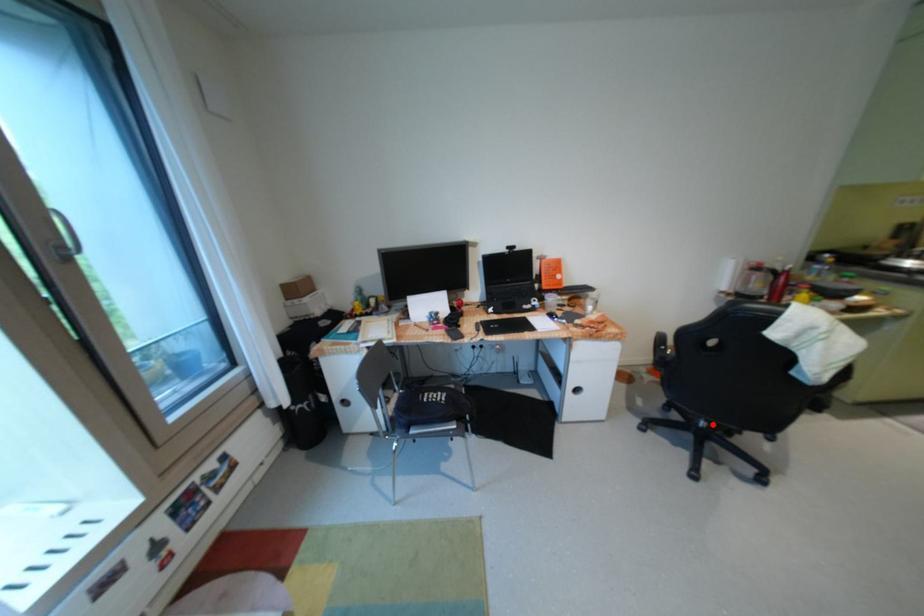
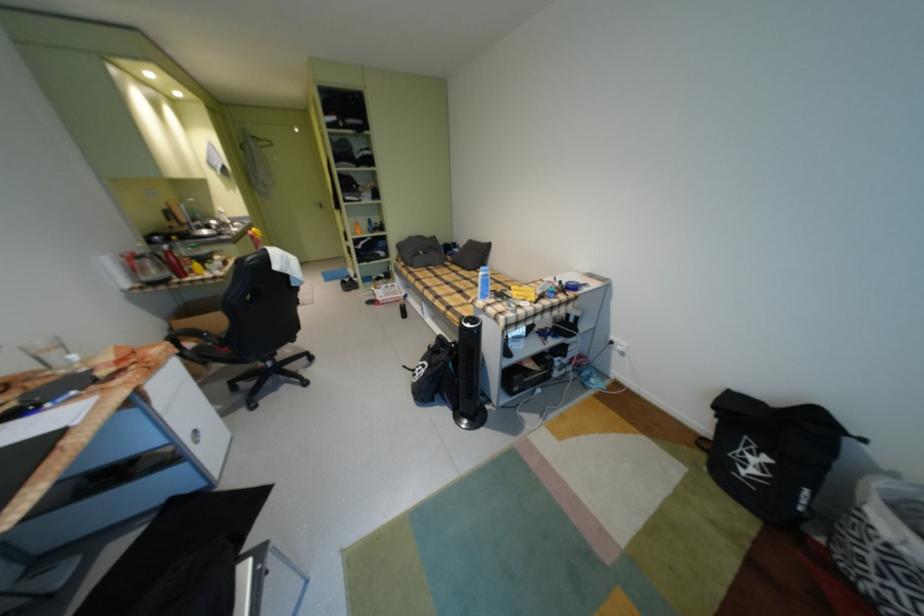
Locate, in the second image, the point that corresponds to the highlighted location in the first image.

(280, 365)